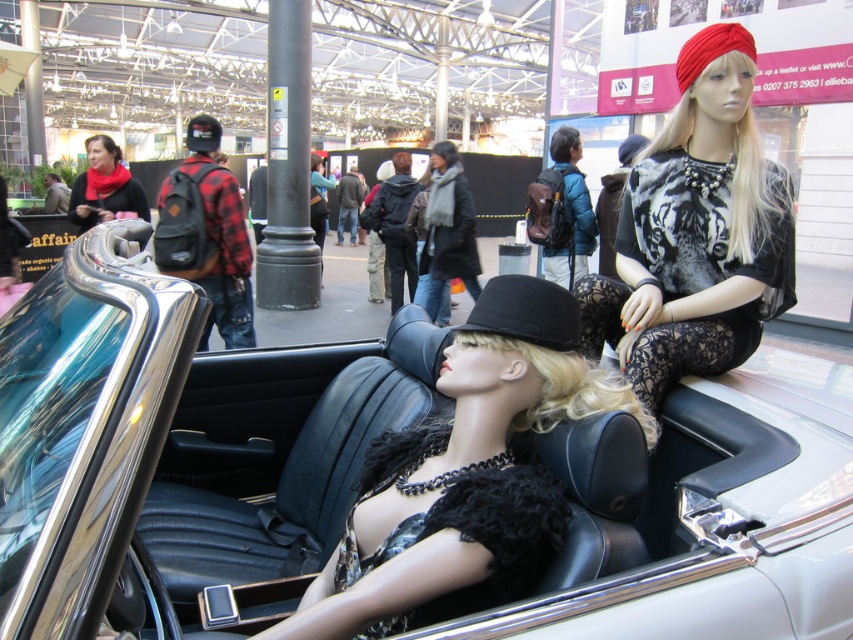
Question: Is black felt hat at center above matte red scarf at upper left?

Choices:
 (A) no
 (B) yes

Answer: (A)

Question: Is blonde hair wig at center above black felt hat at center?

Choices:
 (A) yes
 (B) no

Answer: (B)

Question: Which object appears farthest from the camera in this image?

Choices:
 (A) fuzzy black dress at center
 (B) black lace leggings at center
 (C) white leather car at center
 (D) blonde wig at upper right

Answer: (D)

Question: Is black felt hat at center wider than black fabric hat at upper center?

Choices:
 (A) no
 (B) yes

Answer: (A)

Question: Among these points, which one is nearest to the camera?

Choices:
 (A) (395, 540)
 (B) (759, 385)
 (C) (741, 33)

Answer: (A)

Question: Based on their relative distances, which object is farther from the black plaid shirt at center?

Choices:
 (A) white leather car at center
 (B) fuzzy black dress at center
 (C) matte black coat at center
 (D) blonde hair wig at upper left

Answer: (B)